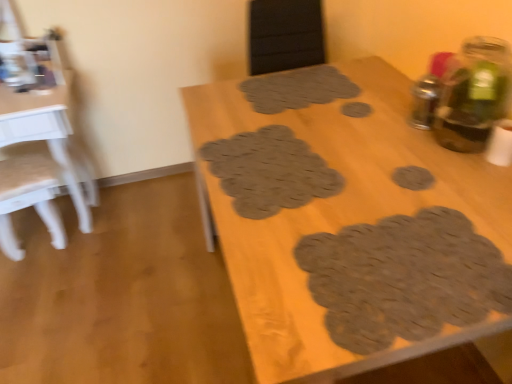
Question: Which is correct: white glossy table at left, marked as the first table in a left-to-right arrangement, is inside brown textured coaster at center-right, the third footprint positioned from the front, or outside of it?

Choices:
 (A) outside
 (B) inside

Answer: (A)

Question: Does point (68, 160) appear closer or farther from the camera than point (413, 188)?

Choices:
 (A) farther
 (B) closer

Answer: (A)

Question: Based on their relative distances, which object is farther from the metallic silver bottle at upper right, which is counted as the first bottle, starting from the back?

Choices:
 (A) brown felt coaster at center, acting as the 2th footprint starting from the top
 (B) brown textured placemats at center, which appears as the 2th table when viewed from the left
 (C) green glass bottle at upper right, acting as the 1th bottle starting from the front
 (D) brown textured mat at center, the third footprint ordered from the bottom
 (E) white glossy table at left, which is the second table in right-to-left order

Answer: (E)

Question: Considering the real-world distances, which object is closest to the metallic silver bottle at upper right, the second bottle viewed from the front?

Choices:
 (A) brown textured placemats at center, which is the 1th table from right to left
 (B) white glossy table at left, which is the second table in right-to-left order
 (C) brown textured mat at center, the 5th footprint in the bottom-to-top sequence
 (D) brown textured coaster at center-right, the second footprint in the bottom-to-top sequence
 (E) green glass bottle at upper right, the 2th bottle from the back

Answer: (E)